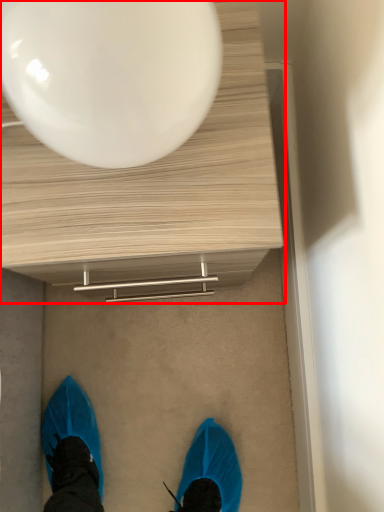
Question: Observing the image, what is the correct spatial positioning of table (annotated by the red box) in reference to balloon?

Choices:
 (A) left
 (B) right

Answer: (B)